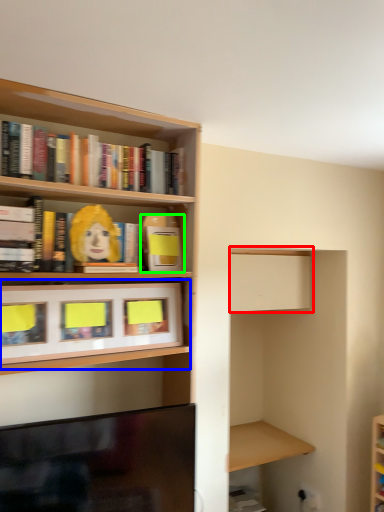
Question: Which is farther away from cabinet (highlighted by a red box)? cabinet (highlighted by a blue box) or book (highlighted by a green box)?

Choices:
 (A) cabinet
 (B) book

Answer: (A)